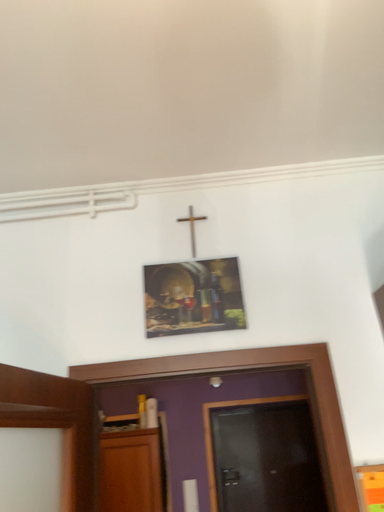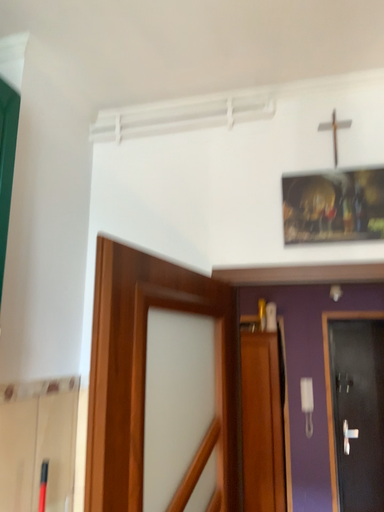
Question: Which way did the camera rotate in the video?

Choices:
 (A) rotated downward
 (B) rotated upward

Answer: (A)